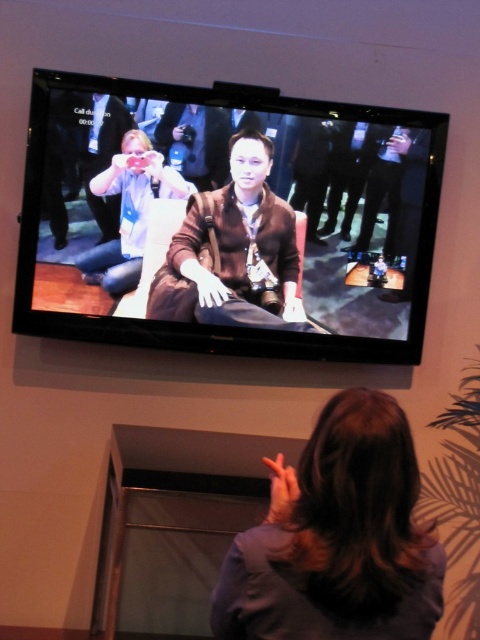
The image size is (480, 640). What do you see at coordinates (337, 538) in the screenshot?
I see `brown hair at upper center` at bounding box center [337, 538].

Is the position of brown hair at upper center less distant than that of matte black jacket at center?

That is True.

Locate an element on the screen. brown hair at upper center is located at coordinates (337, 538).

Does matte black tv at upper center have a greater height compared to brown leather jacket at center?

Indeed, matte black tv at upper center has a greater height compared to brown leather jacket at center.

Which is in front, point (299, 262) or point (240, 275)?

Positioned in front is point (240, 275).

What do you see at coordinates (226, 220) in the screenshot? I see `matte black tv at upper center` at bounding box center [226, 220].

The height and width of the screenshot is (640, 480). I want to click on matte black tv at upper center, so 226,220.

Does brown leather jacket at center have a lesser width compared to matte black jacket at center?

No, brown leather jacket at center is not thinner than matte black jacket at center.

Can you confirm if brown leather jacket at center is positioned to the left of matte black jacket at center?

Incorrect, brown leather jacket at center is not on the left side of matte black jacket at center.

Is point (237, 317) positioned after point (96, 262)?

Yes, point (237, 317) is behind point (96, 262).

Where is `brown leather jacket at center`? This screenshot has height=640, width=480. brown leather jacket at center is located at coordinates (233, 252).